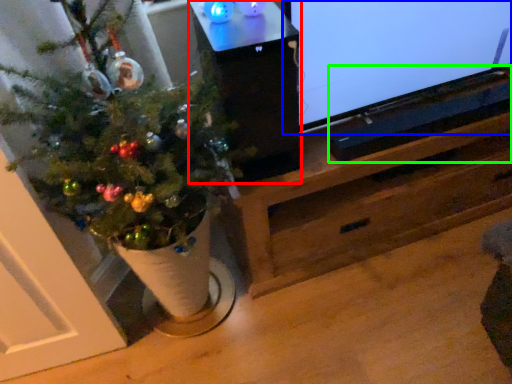
Question: Which object is the farthest from table (highlighted by a red box)? Choose among these: television (highlighted by a blue box) or wide (highlighted by a green box).

Choices:
 (A) television
 (B) wide

Answer: (B)